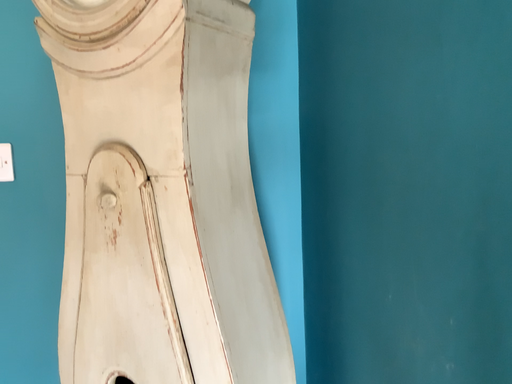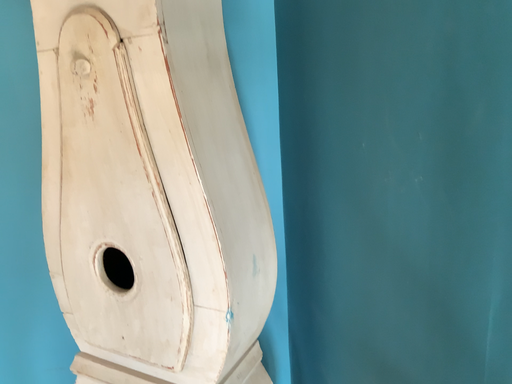
Question: Which way did the camera rotate in the video?

Choices:
 (A) rotated downward
 (B) rotated upward

Answer: (A)